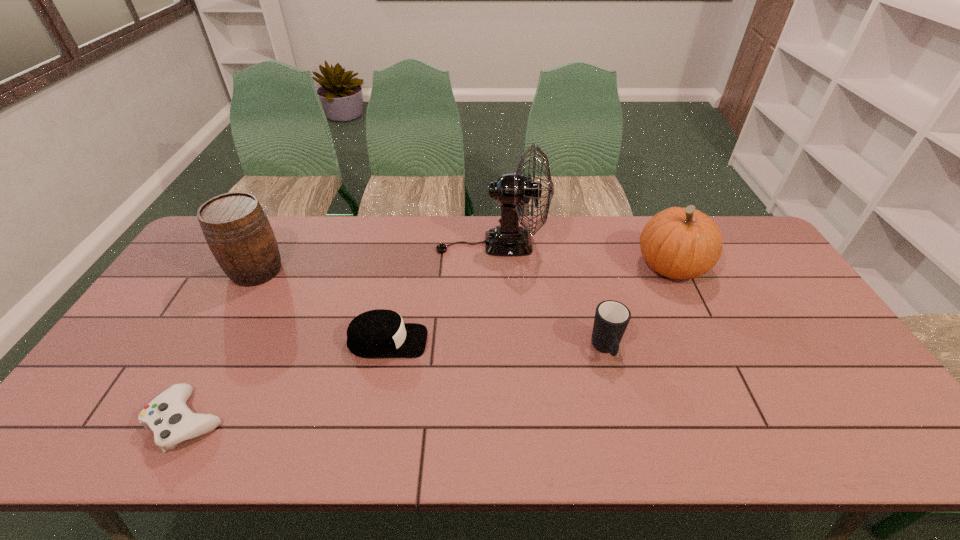
Where is `free space located in front of the tallest object, indicating the direction of air flow`? This screenshot has width=960, height=540. free space located in front of the tallest object, indicating the direction of air flow is located at coordinates (355, 244).

This screenshot has height=540, width=960. I want to click on vacant space located on the stem of the pumpkin, so click(607, 267).

You are a GUI agent. You are given a task and a screenshot of the screen. Output one action in this format:
    pyautogui.click(x=<x>, y=<y>)
    Task: Click on the vacant space located on the stem of the pumpkin
    This screenshot has height=540, width=960.
    Given the screenshot: What is the action you would take?
    pyautogui.click(x=579, y=267)

In order to click on free space located 0.070m on the stem of the pumpkin in this screenshot , I will do `click(612, 267)`.

Identify the location of vacant space situated 0.150m on the side of the cider near the bung hole. (225, 328).

Find the location of `blank space located 0.180m on the side of the fourth tallest object with the handle`. blank space located 0.180m on the side of the fourth tallest object with the handle is located at coordinates (628, 435).

Identify the location of vacant space located on the front-facing side of the cap. (534, 341).

At what (x,y) coordinates should I click in order to perform the action: click on blank space located 0.380m on the back of the shortest object. Please return your answer as a coordinate pair (x, y). This screenshot has height=540, width=960. Looking at the image, I should click on (260, 283).

At what (x,y) coordinates should I click in order to perform the action: click on fan positioned at the far edge. Please return your answer as a coordinate pair (x, y). Looking at the image, I should click on (513, 190).

In order to click on pumpkin present at the far edge in this screenshot , I will do `click(679, 243)`.